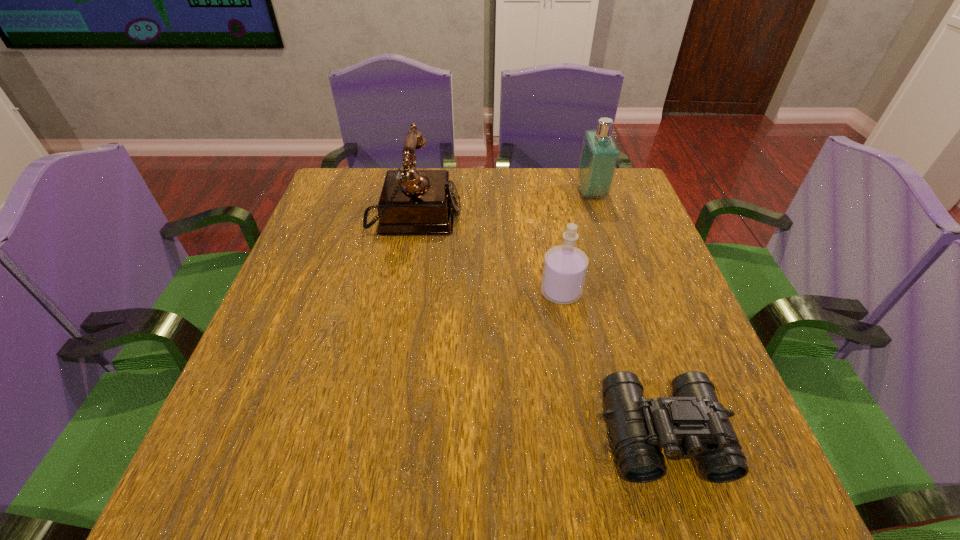
The image size is (960, 540). Identify the location of empty space between the taller perfume and the second nearest object. (576, 243).

Locate an element on the screen. Image resolution: width=960 pixels, height=540 pixels. empty space that is in between the leftmost object and the farther perfume is located at coordinates (502, 206).

This screenshot has height=540, width=960. Find the location of `free space between the second shortest object and the taller perfume`. free space between the second shortest object and the taller perfume is located at coordinates (576, 243).

Find the location of a particular element. free point between the shorter perfume and the farther perfume is located at coordinates (576, 243).

Choose which object is the nearest neighbor to the leftmost object. Please provide its 2D coordinates. Your answer should be formatted as a tuple, i.e. [(x, y)], where the tuple contains the x and y coordinates of a point satisfying the conditions above.

[(565, 266)]

Where is `object that can be found as the third closest to the farther perfume`? This screenshot has width=960, height=540. object that can be found as the third closest to the farther perfume is located at coordinates (692, 424).

Image resolution: width=960 pixels, height=540 pixels. I want to click on vacant region that satisfies the following two spatial constraints: 1. on the back side of the left perfume; 2. on the dial of the leftmost object, so click(x=547, y=218).

Locate an element on the screen. vacant position in the image that satisfies the following two spatial constraints: 1. on the dial of the leftmost object; 2. on the left side of the nearer perfume is located at coordinates (399, 292).

The image size is (960, 540). Identify the location of blank area in the image that satisfies the following two spatial constraints: 1. on the back side of the nearer perfume; 2. on the dial of the telephone. (547, 218).

Locate an element on the screen. Image resolution: width=960 pixels, height=540 pixels. vacant area in the image that satisfies the following two spatial constraints: 1. on the front label of the farther perfume; 2. through the lenses of the shortest object is located at coordinates (669, 434).